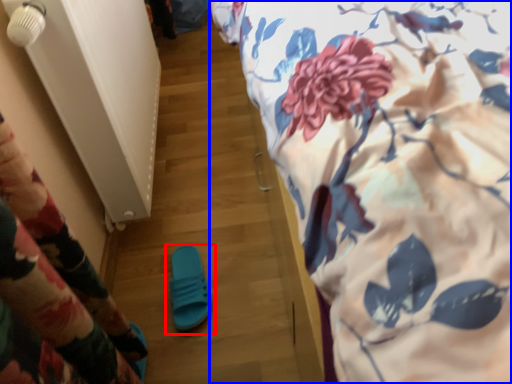
Question: Which point is closer to the camera, footwear (highlighted by a red box) or bed (highlighted by a blue box)?

Choices:
 (A) footwear
 (B) bed

Answer: (B)